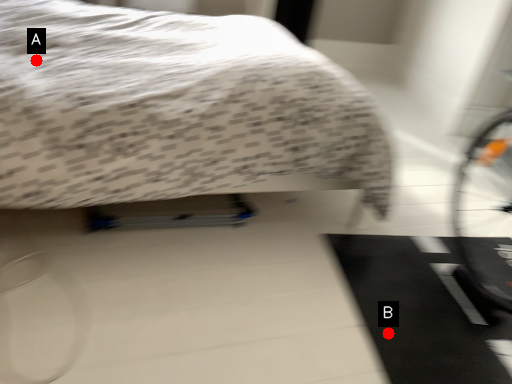
Question: Two points are circled on the image, labeled by A and B beside each circle. Which of the following is the closest to the observer?

Choices:
 (A) A is closer
 (B) B is closer

Answer: (B)